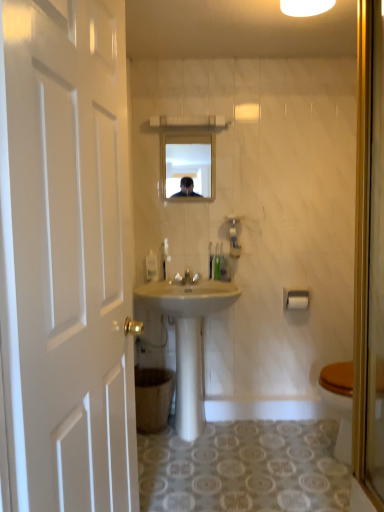
Question: From the image's perspective, is white glossy faucet at center over white glossy light fixture at upper center?

Choices:
 (A) yes
 (B) no

Answer: (B)

Question: From the image's perspective, does white glossy faucet at center appear lower than white glossy light fixture at upper center?

Choices:
 (A) yes
 (B) no

Answer: (A)

Question: Is white glossy faucet at center outside white glossy light fixture at upper center?

Choices:
 (A) no
 (B) yes

Answer: (B)

Question: Is white glossy light fixture at upper center surrounded by white glossy faucet at center?

Choices:
 (A) yes
 (B) no

Answer: (B)

Question: Is white glossy faucet at center in contact with white glossy light fixture at upper center?

Choices:
 (A) yes
 (B) no

Answer: (B)

Question: Looking at their shapes, would you say white plastic towel bar at upper right is wider or thinner than white glossy light fixture at upper center?

Choices:
 (A) wide
 (B) thin

Answer: (B)

Question: From a real-world perspective, relative to white glossy light fixture at upper center, is white plastic towel bar at upper right vertically above or below?

Choices:
 (A) below
 (B) above

Answer: (A)

Question: From the image's perspective, relative to white glossy light fixture at upper center, is white plastic towel bar at upper right above or below?

Choices:
 (A) below
 (B) above

Answer: (A)

Question: Based on their sizes in the image, would you say white plastic towel bar at upper right is bigger or smaller than white glossy light fixture at upper center?

Choices:
 (A) big
 (B) small

Answer: (B)

Question: From a real-world perspective, is translucent plastic toothbrushes at center, positioned as the first toiletries in left-to-right order, physically located above or below white glossy sink at center?

Choices:
 (A) below
 (B) above

Answer: (B)

Question: Is translucent plastic toothbrushes at center, positioned as the first toiletries in left-to-right order, bigger or smaller than white glossy sink at center?

Choices:
 (A) big
 (B) small

Answer: (B)

Question: Is translucent plastic toothbrushes at center, positioned as the first toiletries in left-to-right order, taller or shorter than white glossy sink at center?

Choices:
 (A) tall
 (B) short

Answer: (B)

Question: Is translucent plastic toothbrushes at center, which is the 3th toiletries from right to left, wider or thinner than white glossy sink at center?

Choices:
 (A) wide
 (B) thin

Answer: (B)

Question: Considering the positions of white plastic towel bar at upper right and white glossy faucet at center in the image, is white plastic towel bar at upper right taller or shorter than white glossy faucet at center?

Choices:
 (A) tall
 (B) short

Answer: (A)

Question: Looking at the image, does white plastic towel bar at upper right seem bigger or smaller compared to white glossy faucet at center?

Choices:
 (A) big
 (B) small

Answer: (A)